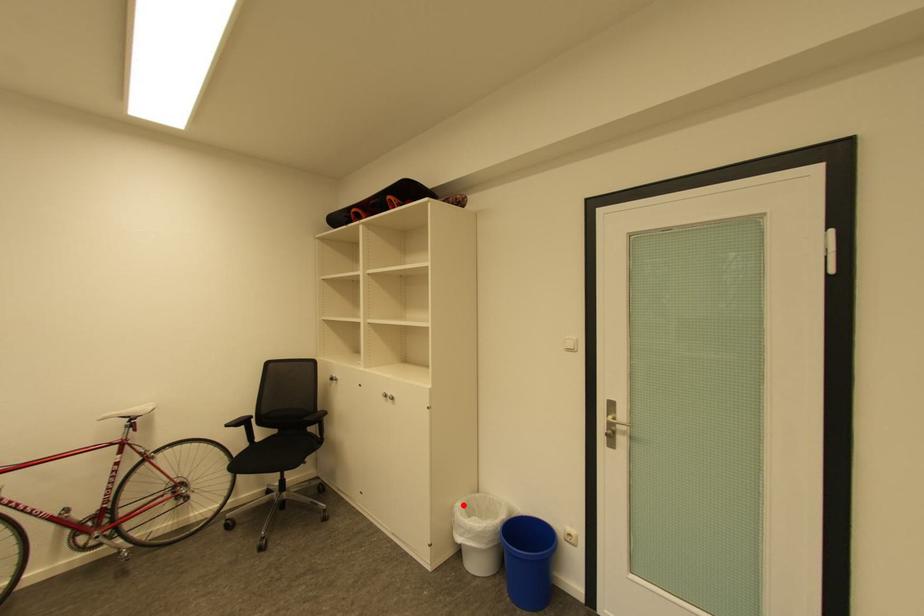
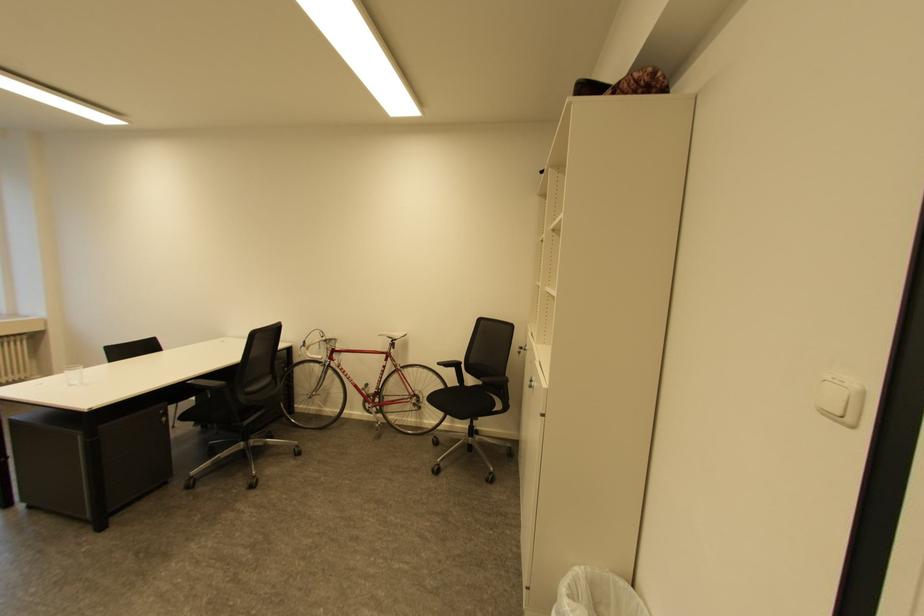
In the second image, find the point that corresponds to the highlighted location in the first image.

(579, 569)